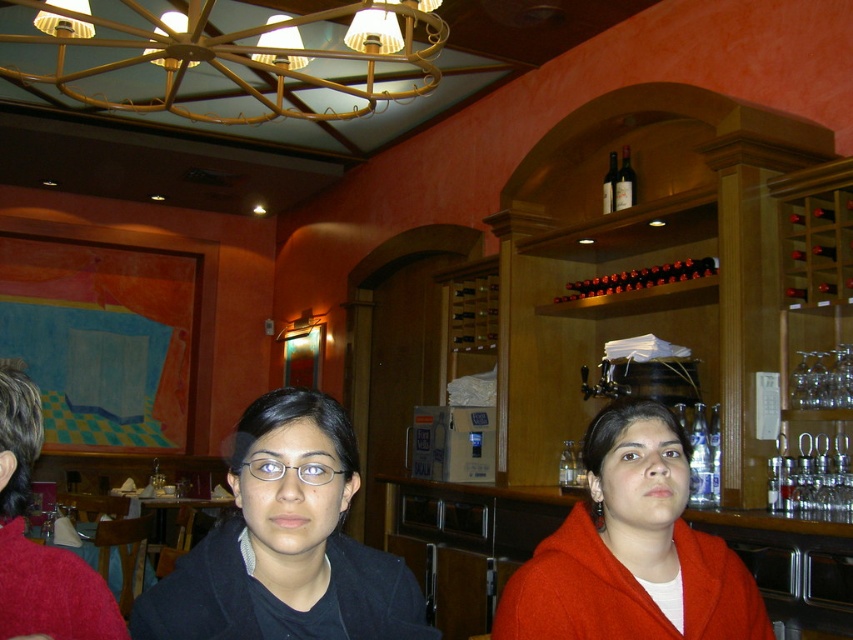
Question: Considering the real-world distances, which object is farthest from the black matte jacket at center?

Choices:
 (A) clear plastic glasses at center
 (B) dark red glass bottle at upper center
 (C) gold metallic chandelier at upper center
 (D) brown glass bottles at upper center

Answer: (B)

Question: Estimate the real-world distances between objects in this image. Which object is closer to the brown glass bottles at upper center?

Choices:
 (A) clear plastic glasses at center
 (B) black matte jacket at center

Answer: (B)

Question: Does brown glass bottles at upper center appear over dark red glass bottle at upper center?

Choices:
 (A) no
 (B) yes

Answer: (A)

Question: Is red wool sweater at left in front of dark glass bottle at upper center?

Choices:
 (A) yes
 (B) no

Answer: (A)

Question: Is black matte jacket at center bigger than red wool sweater at left?

Choices:
 (A) yes
 (B) no

Answer: (B)

Question: Considering the real-world distances, which object is closest to the dark red glass bottle at upper center?

Choices:
 (A) matte orange coat at center
 (B) clear plastic glasses at center
 (C) gold metallic chandelier at upper center

Answer: (C)